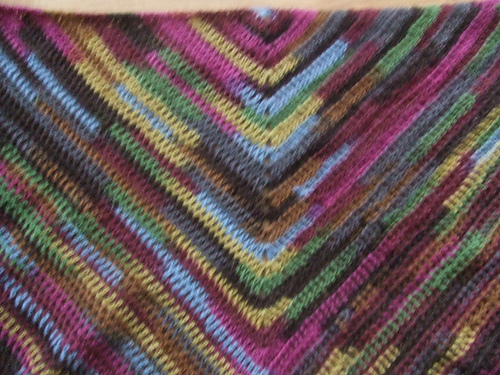
Locate an element on the screen. This screenshot has height=375, width=500. blanket is located at coordinates (242, 183).